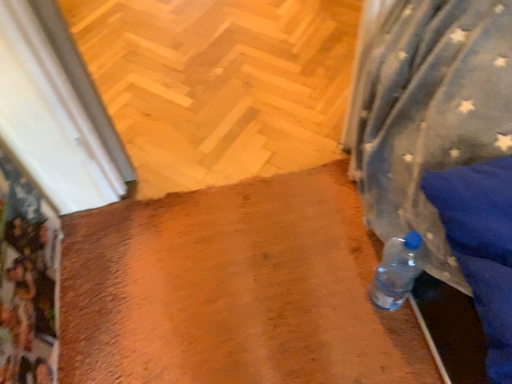
The image size is (512, 384). Find the location of `free spot above clear plastic bottle at lower right (from a real-world perspective)`. free spot above clear plastic bottle at lower right (from a real-world perspective) is located at coordinates (244, 281).